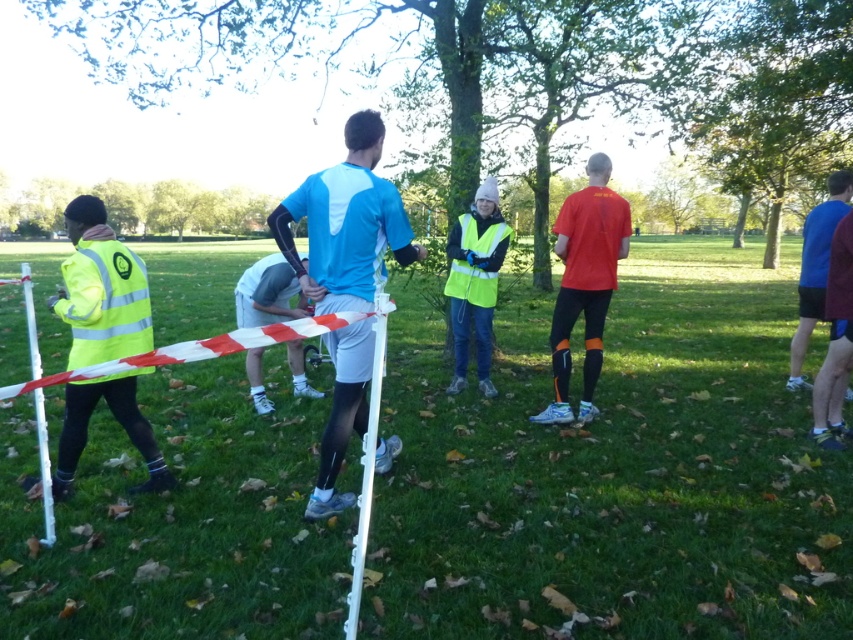
Consider the image. Is neon yellow vest at center in front of light gray fabric shorts at center?

No, neon yellow vest at center is further to the viewer.

Which is in front, point (492, 262) or point (282, 310)?

Positioned in front is point (282, 310).

Locate an element on the screen. The width and height of the screenshot is (853, 640). neon yellow vest at center is located at coordinates (474, 282).

Between point (503, 244) and point (25, 269), which one is positioned behind?

Point (503, 244)

Is neon yellow vest at center to the right of white plastic pole at lower left from the viewer's perspective?

Yes, neon yellow vest at center is to the right of white plastic pole at lower left.

Between point (498, 237) and point (41, 481), which one is positioned in front?

Point (41, 481) is in front.

Locate an element on the screen. neon yellow vest at center is located at coordinates (474, 282).

Is neon yellow reflective safety vest at left to the left of light gray fabric shorts at center from the viewer's perspective?

No, neon yellow reflective safety vest at left is not to the left of light gray fabric shorts at center.

Who is positioned more to the left, neon yellow reflective safety vest at left or light gray fabric shorts at center?

light gray fabric shorts at center

Which is behind, point (77, 317) or point (267, 291)?

The point (267, 291) is more distant.

The height and width of the screenshot is (640, 853). I want to click on neon yellow reflective safety vest at left, so click(x=105, y=304).